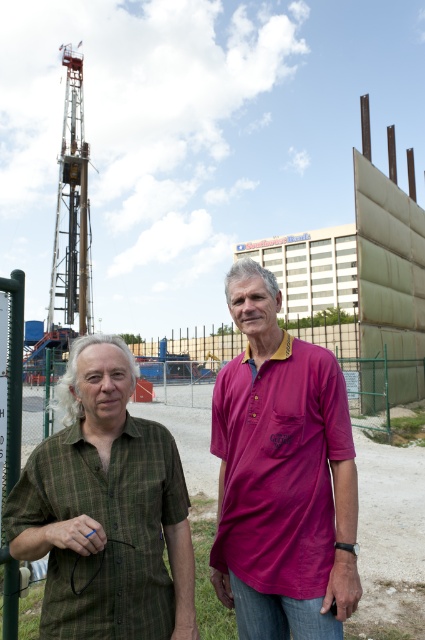
Question: Can you confirm if pink cotton polo shirt at center is positioned below green plaid shirt at left?

Choices:
 (A) no
 (B) yes

Answer: (A)

Question: Among these points, which one is farthest from the camera?

Choices:
 (A) (323, 532)
 (B) (189, 593)

Answer: (A)

Question: Among these objects, which one is farthest from the camera?

Choices:
 (A) green plaid shirt at center
 (B) green plaid shirt at left
 (C) pink cotton polo shirt at center

Answer: (C)

Question: Is green plaid shirt at center positioned in front of pink cotton polo shirt at center?

Choices:
 (A) yes
 (B) no

Answer: (A)

Question: Which object is positioned closest to the green plaid shirt at center?

Choices:
 (A) pink cotton polo shirt at center
 (B) green plaid shirt at left

Answer: (A)

Question: Can you confirm if green plaid shirt at center is bigger than pink cotton polo shirt at center?

Choices:
 (A) no
 (B) yes

Answer: (B)